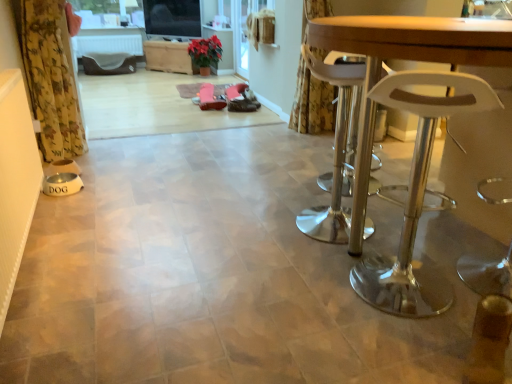
Measure the distance between floral fabric curtain at upper right, the first curtain from the back, and camera.

floral fabric curtain at upper right, the first curtain from the back, is 8.56 feet from camera.

Measure the distance between point (210, 64) and camera.

Point (210, 64) and camera are 6.12 meters apart.

You are a GUI agent. You are given a task and a screenshot of the screen. Output one action in this format:
    pyautogui.click(x=<x>, y=<y>)
    Task: Click on the clear plastic stool at right
    This screenshot has height=384, width=512.
    Given the screenshot: What is the action you would take?
    pyautogui.click(x=417, y=197)

Identify the location of floral fabric curtain at upper right, the first curtain from the back. tap(312, 104).

Between transparent glass screen door at upper center and green matte plant at center, which one appears on the left side from the viewer's perspective?

Positioned to the left is green matte plant at center.

Are transparent glass screen door at upper center and green matte plant at center located far from each other?

No, transparent glass screen door at upper center is in close proximity to green matte plant at center.

How many degrees apart are the facing directions of transparent glass screen door at upper center and green matte plant at center?

The angular difference between transparent glass screen door at upper center and green matte plant at center is 97.7 degrees.

Between floral fabric curtain at upper right, the first curtain from the back, and clear plastic stool at right, which one has less height?

With less height is clear plastic stool at right.

Does point (307, 99) come farther from viewer compared to point (414, 160)?

Yes, it is behind point (414, 160).

Considering the relative sizes of floral fabric curtain at upper right, positioned as the first curtain in right-to-left order, and clear plastic stool at right in the image provided, is floral fabric curtain at upper right, positioned as the first curtain in right-to-left order, bigger than clear plastic stool at right?

No, floral fabric curtain at upper right, positioned as the first curtain in right-to-left order, is not bigger than clear plastic stool at right.

From the image's perspective, is floral fabric curtain at upper right, which ranks as the second curtain in front-to-back order, on top of clear plastic stool at right?

Correct, floral fabric curtain at upper right, which ranks as the second curtain in front-to-back order, appears higher than clear plastic stool at right in the image.

Is floral fabric curtain at upper right, which ranks as the second curtain in front-to-back order, further to camera compared to wooden table at right?

Yes, it is behind wooden table at right.

Would you consider floral fabric curtain at upper right, positioned as the first curtain in right-to-left order, to be distant from wooden table at right?

Yes, floral fabric curtain at upper right, positioned as the first curtain in right-to-left order, and wooden table at right are located far from each other.

Which is correct: floral fabric curtain at upper right, which ranks as the second curtain in front-to-back order, is inside wooden table at right, or outside of it?

floral fabric curtain at upper right, which ranks as the second curtain in front-to-back order, is located beyond the bounds of wooden table at right.

Consider the image. Considering the positions of objects floral fabric curtain at upper right, the first curtain from the back, and wooden table at right in the image provided, who is more to the right, floral fabric curtain at upper right, the first curtain from the back, or wooden table at right?

From the viewer's perspective, wooden table at right appears more on the right side.

Who is smaller, transparent glass screen door at upper center or clear plastic stool at right?

Smaller between the two is transparent glass screen door at upper center.

Identify the location of stool below the transparent glass screen door at upper center (from the image's perspective). This screenshot has height=384, width=512. (417, 197).

Is transparent glass screen door at upper center wider than clear plastic stool at right?

Incorrect, the width of transparent glass screen door at upper center does not surpass that of clear plastic stool at right.

From the image's perspective, does transparent glass screen door at upper center appear lower than clear plastic stool at right?

No, from the image's perspective, transparent glass screen door at upper center is not beneath clear plastic stool at right.

Can you tell me how much wooden table at right and clear plastic stool at right differ in facing direction?

They differ by 135 degrees in their facing directions.

Is wooden table at right inside or outside of clear plastic stool at right?

wooden table at right is spatially situated outside clear plastic stool at right.

Is wooden table at right aimed at clear plastic stool at right?

Yes, wooden table at right is oriented towards clear plastic stool at right.

Is wooden table at right taller or shorter than clear plastic stool at right?

In the image, wooden table at right appears to be taller than clear plastic stool at right.

Is transparent glass screen door at upper center completely or partially outside of wooden table at right?

Indeed, transparent glass screen door at upper center is completely outside wooden table at right.

Can you confirm if transparent glass screen door at upper center is wider than wooden table at right?

Incorrect, the width of transparent glass screen door at upper center does not surpass that of wooden table at right.

From the image's perspective, is transparent glass screen door at upper center located beneath wooden table at right?

Actually, transparent glass screen door at upper center appears above wooden table at right in the image.

Is yellow floral fabric curtain at left, which ranks as the 2th curtain in back-to-front order, taller than green matte plant at center?

Correct, yellow floral fabric curtain at left, which ranks as the 2th curtain in back-to-front order, is much taller as green matte plant at center.

Does yellow floral fabric curtain at left, arranged as the second curtain when viewed from the right, appear on the right side of green matte plant at center?

Incorrect, yellow floral fabric curtain at left, arranged as the second curtain when viewed from the right, is not on the right side of green matte plant at center.

How much distance is there between yellow floral fabric curtain at left, the 1th curtain in the front-to-back sequence, and green matte plant at center?

They are 11.30 feet apart.

Is yellow floral fabric curtain at left, the 1th curtain in the front-to-back sequence, far from green matte plant at center?

Indeed, yellow floral fabric curtain at left, the 1th curtain in the front-to-back sequence, is not near green matte plant at center.

The image size is (512, 384). I want to click on screen door on the right of green matte plant at center, so [241, 36].

The width and height of the screenshot is (512, 384). In order to click on stool that appears below the floral fabric curtain at upper right, which ranks as the second curtain in front-to-back order (from a real-world perspective) in this screenshot , I will do `click(417, 197)`.

Estimate the real-world distances between objects in this image. Which object is further from green matte plant at center, transparent glass screen door at upper center or yellow floral fabric curtain at left, arranged as the second curtain when viewed from the right?

yellow floral fabric curtain at left, arranged as the second curtain when viewed from the right, is positioned further to the anchor green matte plant at center.

Based on their spatial positions, is wooden table at right or floral fabric curtain at upper right, which ranks as the second curtain in front-to-back order, closer to transparent glass screen door at upper center?

floral fabric curtain at upper right, which ranks as the second curtain in front-to-back order, is closer to transparent glass screen door at upper center.

Looking at the image, which one is located further to yellow floral fabric curtain at left, marked as the first curtain in a left-to-right arrangement, wooden table at right or transparent glass screen door at upper center?

Based on the image, transparent glass screen door at upper center appears to be further to yellow floral fabric curtain at left, marked as the first curtain in a left-to-right arrangement.

From the picture: From the image, which object appears to be nearer to green matte plant at center, yellow floral fabric curtain at left, which ranks as the 2th curtain in back-to-front order, or transparent glass screen door at upper center?

transparent glass screen door at upper center is closer to green matte plant at center.

Estimate the real-world distances between objects in this image. Which object is closer to clear plastic stool at right, wooden table at right or transparent glass screen door at upper center?

wooden table at right is positioned closer to the anchor clear plastic stool at right.

When comparing their distances from floral fabric curtain at upper right, positioned as the first curtain in right-to-left order, does green matte plant at center or yellow floral fabric curtain at left, arranged as the second curtain when viewed from the right, seem closer?

The object closer to floral fabric curtain at upper right, positioned as the first curtain in right-to-left order, is yellow floral fabric curtain at left, arranged as the second curtain when viewed from the right.

From the image, which object appears to be nearer to clear plastic stool at right, yellow floral fabric curtain at left, arranged as the second curtain when viewed from the right, or green matte plant at center?

Among the two, yellow floral fabric curtain at left, arranged as the second curtain when viewed from the right, is located nearer to clear plastic stool at right.

When comparing their distances from floral fabric curtain at upper right, positioned as the first curtain in right-to-left order, does clear plastic stool at right or yellow floral fabric curtain at left, marked as the first curtain in a left-to-right arrangement, seem further?

Among the two, yellow floral fabric curtain at left, marked as the first curtain in a left-to-right arrangement, is located further to floral fabric curtain at upper right, positioned as the first curtain in right-to-left order.

You are a GUI agent. You are given a task and a screenshot of the screen. Output one action in this format:
    pyautogui.click(x=<x>, y=<y>)
    Task: Click on the stool between wooden table at right and floral fabric curtain at upper right, marked as the second curtain in a left-to-right arrangement, along the z-axis
    The width and height of the screenshot is (512, 384).
    Given the screenshot: What is the action you would take?
    pyautogui.click(x=417, y=197)

You are a GUI agent. You are given a task and a screenshot of the screen. Output one action in this format:
    pyautogui.click(x=<x>, y=<y>)
    Task: Click on the stool positioned between wooden table at right and transparent glass screen door at upper center from near to far
    This screenshot has width=512, height=384.
    Given the screenshot: What is the action you would take?
    pyautogui.click(x=417, y=197)

Image resolution: width=512 pixels, height=384 pixels. I want to click on curtain between yellow floral fabric curtain at left, which ranks as the 2th curtain in back-to-front order, and green matte plant at center, along the z-axis, so click(x=312, y=104).

Where is `screen door between clear plastic stool at right and green matte plant at center along the z-axis`? The image size is (512, 384). screen door between clear plastic stool at right and green matte plant at center along the z-axis is located at coordinates pos(241,36).